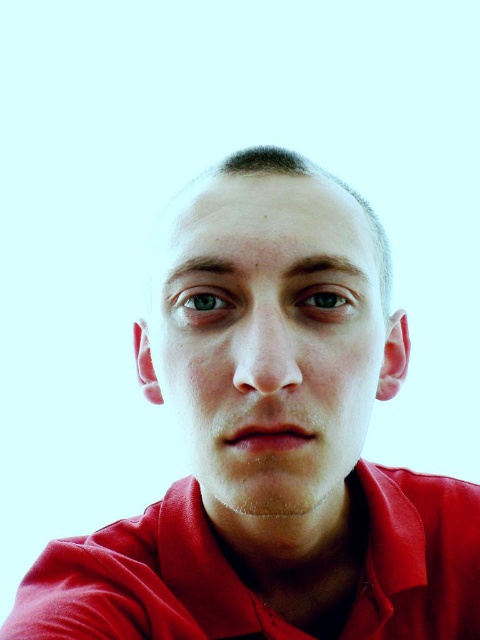
Is point (375, 531) positioned in front of point (227, 314)?

No, it is not.

Between matte red polo shirt at center and green matte eye at center, which one appears on the left side from the viewer's perspective?

Positioned to the left is green matte eye at center.

Is point (93, 548) more distant than point (225, 300)?

Yes, point (93, 548) is farther from viewer.

Where is `matte red polo shirt at center`? matte red polo shirt at center is located at coordinates (144, 582).

Does matte red face at center come in front of matte brown eye at center?

Yes, it is in front of matte brown eye at center.

Who is positioned more to the left, matte red face at center or matte brown eye at center?

matte red face at center is more to the left.

Who is more distant from viewer, (192, 369) or (335, 320)?

Point (335, 320)

Locate an element on the screen. Image resolution: width=480 pixels, height=640 pixels. matte red face at center is located at coordinates (268, 340).

In the scene shown: Is matte red face at center positioned before matte red polo shirt at center?

Yes, matte red face at center is in front of matte red polo shirt at center.

Describe the element at coordinates (268, 340) in the screenshot. This screenshot has width=480, height=640. I see `matte red face at center` at that location.

Locate an element on the screen. This screenshot has width=480, height=640. matte red face at center is located at coordinates (268, 340).